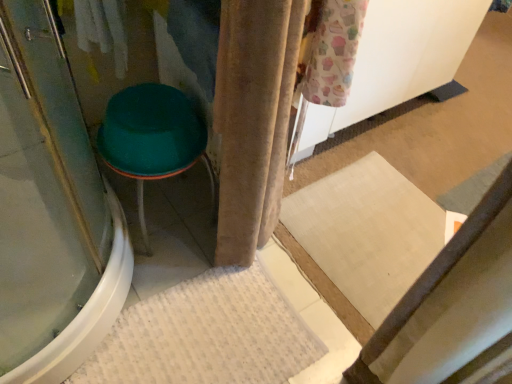
This screenshot has width=512, height=384. I want to click on vacant area on top of white textured bath mat at lower center (from a real-world perspective), so click(187, 348).